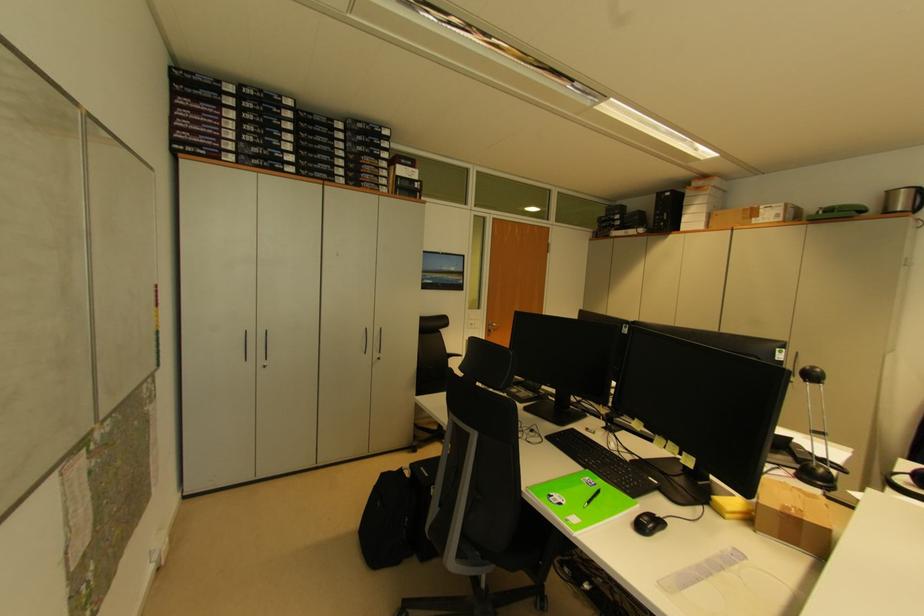
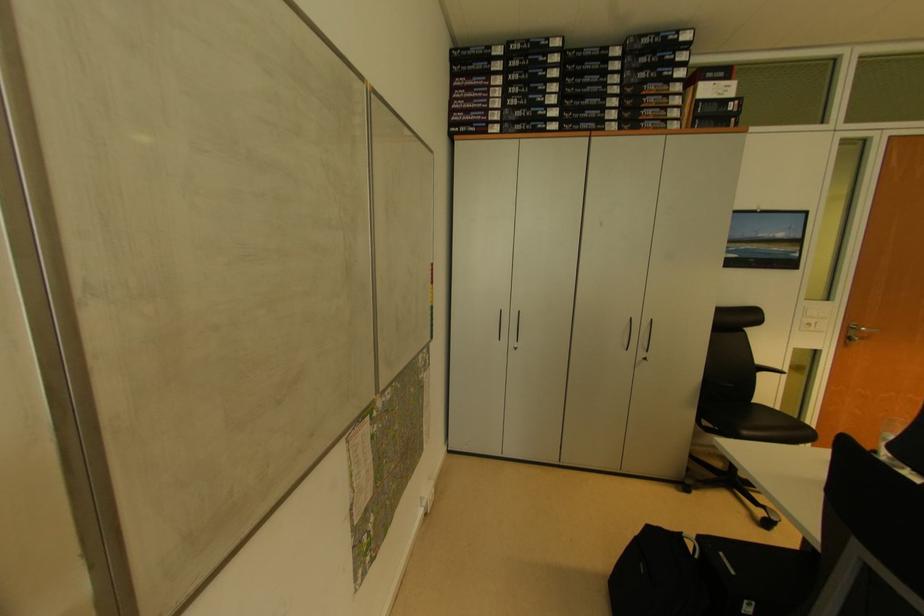
Where in the second image is the point corresponding to point 368,336 from the first image?

(631, 326)